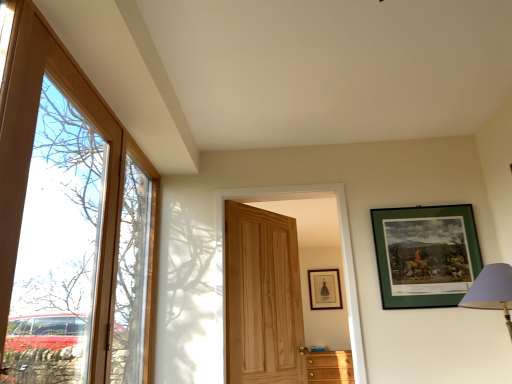
Question: Which direction should I rotate to look at matte black picture frame at upper center, which appears as the 2th picture frame when viewed from the front?

Choices:
 (A) left
 (B) right

Answer: (B)

Question: Is matte black picture frame at upper center, the second picture frame positioned from the top, wider than green matte picture frame at upper right, which appears as the 1th picture frame when viewed from the top?

Choices:
 (A) no
 (B) yes

Answer: (A)

Question: From the image's perspective, is matte black picture frame at upper center, which appears as the 2th picture frame when viewed from the front, under green matte picture frame at upper right, which appears as the 1th picture frame when viewed from the top?

Choices:
 (A) yes
 (B) no

Answer: (A)

Question: Is matte black picture frame at upper center, which is the first picture frame from back to front, located outside green matte picture frame at upper right, which appears as the 1th picture frame when viewed from the top?

Choices:
 (A) no
 (B) yes

Answer: (B)

Question: Is matte black picture frame at upper center, which ranks as the first picture frame in bottom-to-top order, bigger than green matte picture frame at upper right, marked as the 2th picture frame in a back-to-front arrangement?

Choices:
 (A) no
 (B) yes

Answer: (A)

Question: From the image's perspective, would you say matte black picture frame at upper center, which appears as the 2th picture frame when viewed from the front, is positioned over green matte picture frame at upper right, which ranks as the second picture frame in bottom-to-top order?

Choices:
 (A) yes
 (B) no

Answer: (B)

Question: Are matte black picture frame at upper center, the second picture frame positioned from the top, and green matte picture frame at upper right, arranged as the 1th picture frame when viewed from the front, located far from each other?

Choices:
 (A) no
 (B) yes

Answer: (B)

Question: Could you tell me if natural wood door at center, which is the 2th door from left to right, is facing matte black picture frame at upper center, which ranks as the first picture frame in bottom-to-top order?

Choices:
 (A) no
 (B) yes

Answer: (A)

Question: Is natural wood door at center, acting as the 1th door starting from the right, not near matte black picture frame at upper center, which is the first picture frame from back to front?

Choices:
 (A) yes
 (B) no

Answer: (A)

Question: From a real-world perspective, is natural wood door at center, acting as the 1th door starting from the right, located beneath matte black picture frame at upper center, which is the first picture frame from back to front?

Choices:
 (A) no
 (B) yes

Answer: (B)

Question: Can you confirm if natural wood door at center, the 2th door positioned from the front, is wider than matte black picture frame at upper center, which ranks as the first picture frame in bottom-to-top order?

Choices:
 (A) no
 (B) yes

Answer: (B)

Question: Is natural wood door at center, the 1th door from the back, next to matte black picture frame at upper center, which appears as the 2th picture frame when viewed from the front?

Choices:
 (A) no
 (B) yes

Answer: (A)

Question: Can you confirm if natural wood door at center, acting as the 1th door starting from the right, is thinner than matte black picture frame at upper center, the second picture frame positioned from the top?

Choices:
 (A) no
 (B) yes

Answer: (A)

Question: Does green matte picture frame at upper right, arranged as the 1th picture frame when viewed from the front, have a smaller size compared to wooden cabinet at lower right?

Choices:
 (A) yes
 (B) no

Answer: (A)